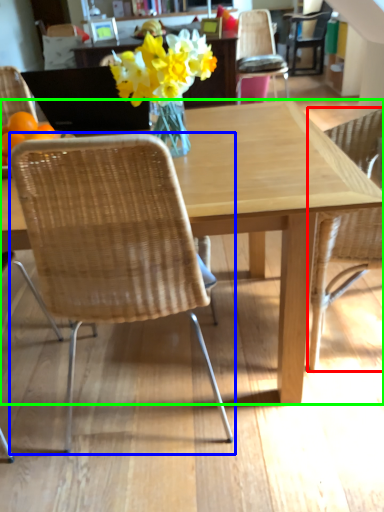
Question: Which object is positioned farthest from chair (highlighted by a red box)? Select from chair (highlighted by a blue box) and kitchen & dining room table (highlighted by a green box).

Choices:
 (A) chair
 (B) kitchen & dining room table

Answer: (A)